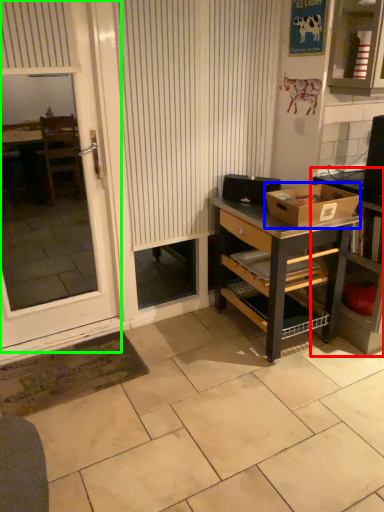
Question: Which object is the closest to the shelf (highlighted by a red box)? Choose among these: box (highlighted by a blue box) or screen door (highlighted by a green box).

Choices:
 (A) box
 (B) screen door

Answer: (A)